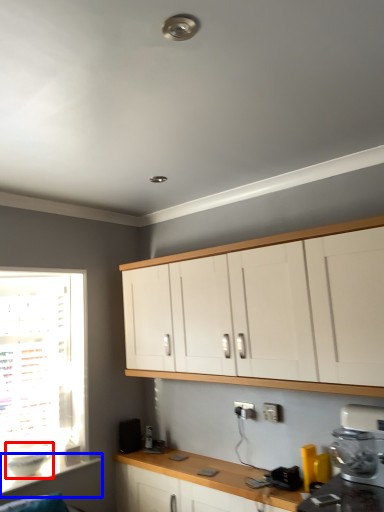
Question: Which of the following is the farthest to the observer, appliance (highlighted by a red box) or window sill (highlighted by a blue box)?

Choices:
 (A) appliance
 (B) window sill

Answer: (A)